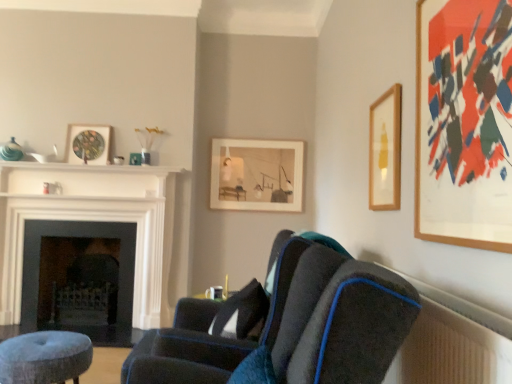
Question: Can you confirm if velvet blue stool at lower left is positioned to the right of white glossy fireplace at left, the 2th fireplace positioned from the back?

Choices:
 (A) yes
 (B) no

Answer: (A)

Question: Can we say velvet blue stool at lower left lies outside white glossy fireplace at left, arranged as the first fireplace when viewed from the front?

Choices:
 (A) yes
 (B) no

Answer: (A)

Question: Is velvet blue stool at lower left closer to camera compared to white glossy fireplace at left, arranged as the first fireplace when viewed from the front?

Choices:
 (A) no
 (B) yes

Answer: (B)

Question: From a real-world perspective, does velvet blue stool at lower left sit lower than white glossy fireplace at left, the 2th fireplace positioned from the back?

Choices:
 (A) no
 (B) yes

Answer: (B)

Question: Can you confirm if velvet blue stool at lower left is wider than white glossy fireplace at left, arranged as the first fireplace when viewed from the front?

Choices:
 (A) no
 (B) yes

Answer: (B)

Question: Would you say velvet blue stool at lower left contains white glossy fireplace at left, the 2th fireplace positioned from the back?

Choices:
 (A) no
 (B) yes

Answer: (A)

Question: Is white glossy fireplace at left, the 2th fireplace positioned from the back, surrounding white glossy balustrade at upper center?

Choices:
 (A) no
 (B) yes

Answer: (B)

Question: Is white glossy fireplace at left, the 2th fireplace positioned from the back, positioned before white glossy balustrade at upper center?

Choices:
 (A) yes
 (B) no

Answer: (B)

Question: From a real-world perspective, is white glossy fireplace at left, the 2th fireplace positioned from the back, located beneath white glossy balustrade at upper center?

Choices:
 (A) yes
 (B) no

Answer: (A)

Question: Does white glossy fireplace at left, arranged as the first fireplace when viewed from the front, appear on the left side of white glossy balustrade at upper center?

Choices:
 (A) yes
 (B) no

Answer: (A)

Question: Considering the relative sizes of white glossy fireplace at left, the 2th fireplace positioned from the back, and white glossy balustrade at upper center in the image provided, is white glossy fireplace at left, the 2th fireplace positioned from the back, smaller than white glossy balustrade at upper center?

Choices:
 (A) no
 (B) yes

Answer: (A)

Question: From the image's perspective, is white glossy fireplace at left, arranged as the first fireplace when viewed from the front, below white glossy balustrade at upper center?

Choices:
 (A) yes
 (B) no

Answer: (A)

Question: Is wooden framed artwork at upper right, the fourth picture frame from the back, next to matte glass picture frame at upper left, which is the first picture frame from left to right, and touching it?

Choices:
 (A) no
 (B) yes

Answer: (A)